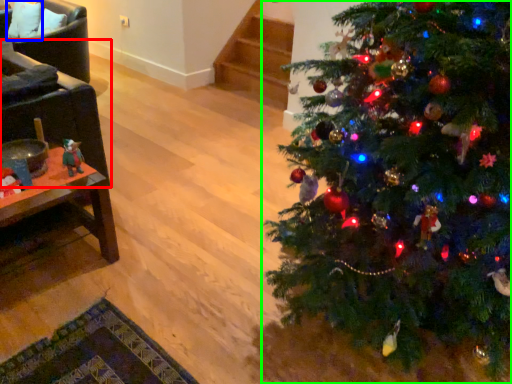
Question: Which object is positioned closest to armchair (highlighted by a red box)? Select from pillow (highlighted by a blue box) and christmas tree (highlighted by a green box).

Choices:
 (A) pillow
 (B) christmas tree

Answer: (B)